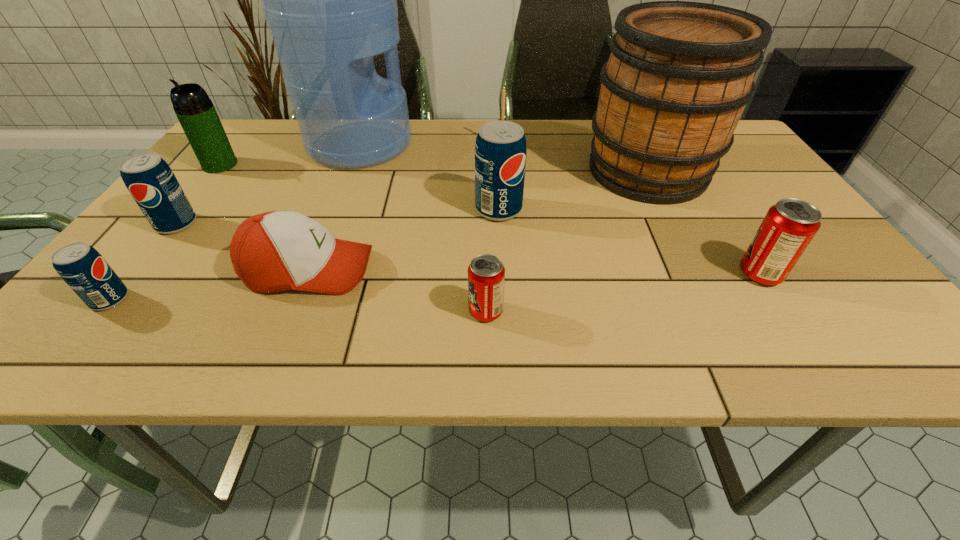
I want to click on thermos bottle that is positioned at the left edge, so click(x=195, y=111).

Where is `cider at the right edge`? This screenshot has height=540, width=960. cider at the right edge is located at coordinates (680, 73).

Where is `soda can that is at the right edge`? soda can that is at the right edge is located at coordinates (789, 226).

Where is `object that is at the far left corner`? object that is at the far left corner is located at coordinates (195, 111).

Identify the location of object present at the far right corner. (680, 73).

Locate an element on the screen. The height and width of the screenshot is (540, 960). free spot at the far edge of the desktop is located at coordinates (480, 122).

In the image, there is a desktop. At what (x,y) coordinates should I click in order to perform the action: click on vacant space at the near edge. Please return your answer as a coordinate pair (x, y). Looking at the image, I should click on (547, 359).

The height and width of the screenshot is (540, 960). What are the coordinates of `free space at the left edge of the desktop` in the screenshot? It's located at (164, 237).

Where is `vacant region at the right edge of the desktop`? Image resolution: width=960 pixels, height=540 pixels. vacant region at the right edge of the desktop is located at coordinates (727, 210).

Locate an element on the screen. free point between the smaller red soda can and the bigger red soda can is located at coordinates (623, 293).